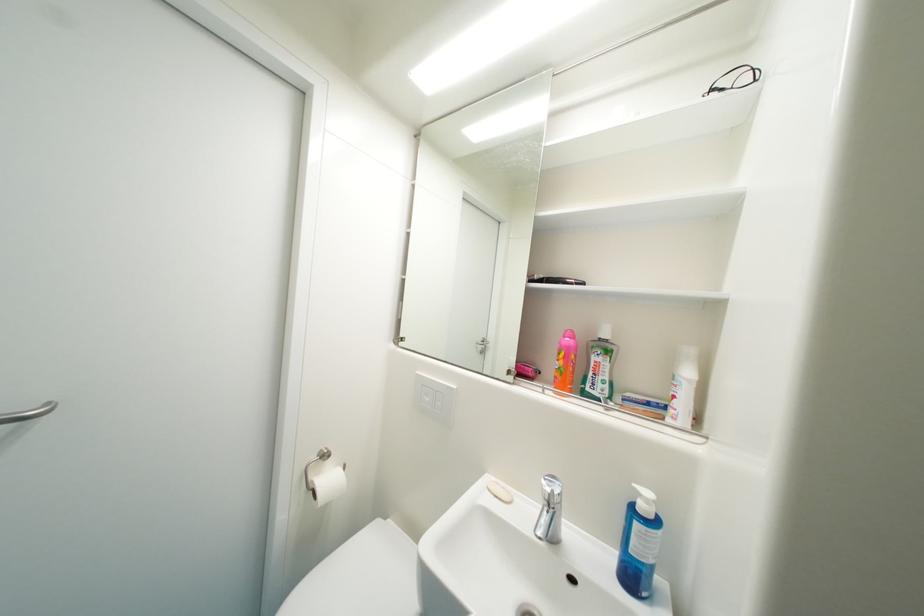
Which object does [565,362] point to?

It refers to a orange toothbrush.